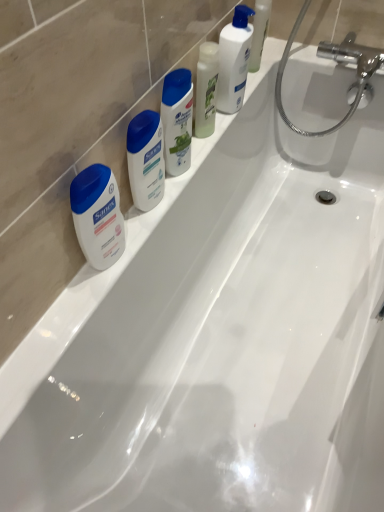
Question: Is white glossy lotion at upper center, which appears as the first cleaning product when viewed from the right, inside the boundaries of white matte sanex soap at left, placed as the second toiletry when sorted from right to left, or outside?

Choices:
 (A) outside
 (B) inside

Answer: (A)

Question: From a real-world perspective, is white glossy lotion at upper center, positioned as the third cleaning product in left-to-right order, positioned above or below white matte sanex soap at left, the 1th toiletry when ordered from left to right?

Choices:
 (A) above
 (B) below

Answer: (A)

Question: Based on their relative distances, which object is farther from the white matte sanex soap at left, placed as the second toiletry when sorted from right to left?

Choices:
 (A) white glossy lotion at upper center, which appears as the first cleaning product when viewed from the right
 (B) translucent plastic bottle at upper center, the 2th cleaning product viewed from the left
 (C) matte white lotion at center, placed as the second toiletry when sorted from left to right
 (D) white glossy shampoo at center, the 1th cleaning product viewed from the left

Answer: (A)

Question: Based on their relative distances, which object is nearer to the matte white lotion at center, the 1th toiletry positioned from the right?

Choices:
 (A) white glossy shampoo at center, which is the 3th cleaning product in right-to-left order
 (B) white matte sanex soap at left, placed as the second toiletry when sorted from right to left
 (C) white glossy lotion at upper center, positioned as the third cleaning product in left-to-right order
 (D) translucent plastic bottle at upper center, the 2th cleaning product viewed from the left

Answer: (A)